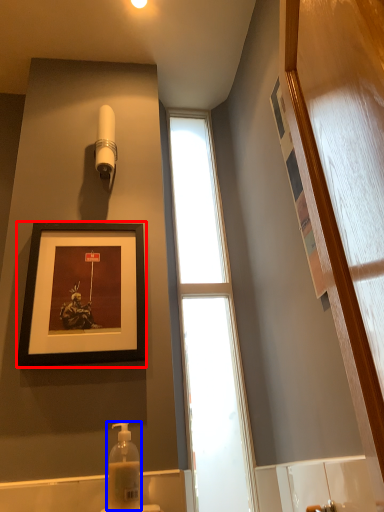
Question: Which object is closer to the camera taking this photo, picture frame (highlighted by a red box) or soap dispenser (highlighted by a blue box)?

Choices:
 (A) picture frame
 (B) soap dispenser

Answer: (B)